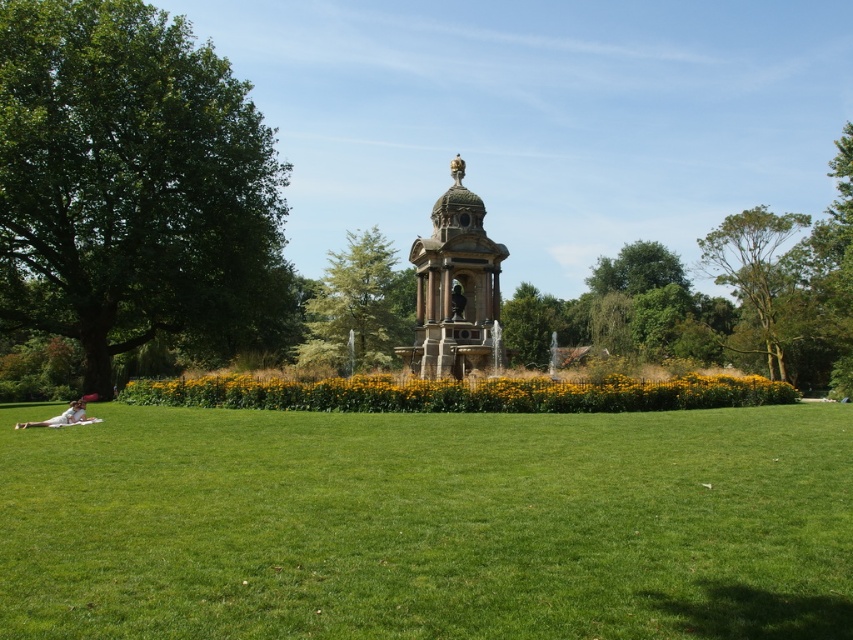
Is point (473, 314) less distant than point (328, 349)?

That is True.

Can you confirm if bronze statue at center is smaller than green leafy tree at center?

Correct, bronze statue at center occupies less space than green leafy tree at center.

Measure the distance between point (409, 360) and camera.

Point (409, 360) is 72.71 meters from camera.

This screenshot has width=853, height=640. In order to click on bronze statue at center in this screenshot , I will do `click(454, 285)`.

Who is lower down, green leafy tree at left or white fabric person at lower left?

Positioned lower is white fabric person at lower left.

Is green leafy tree at left closer to camera compared to white fabric person at lower left?

That is False.

Is point (9, 230) positioned after point (33, 424)?

Yes, point (9, 230) is behind point (33, 424).

The image size is (853, 640). I want to click on green leafy tree at left, so click(131, 182).

Measure the distance between point (727, 612) and camera.

They are 49.93 feet apart.

The height and width of the screenshot is (640, 853). Describe the element at coordinates (427, 524) in the screenshot. I see `green grassy field at center` at that location.

The image size is (853, 640). I want to click on green grassy field at center, so click(427, 524).